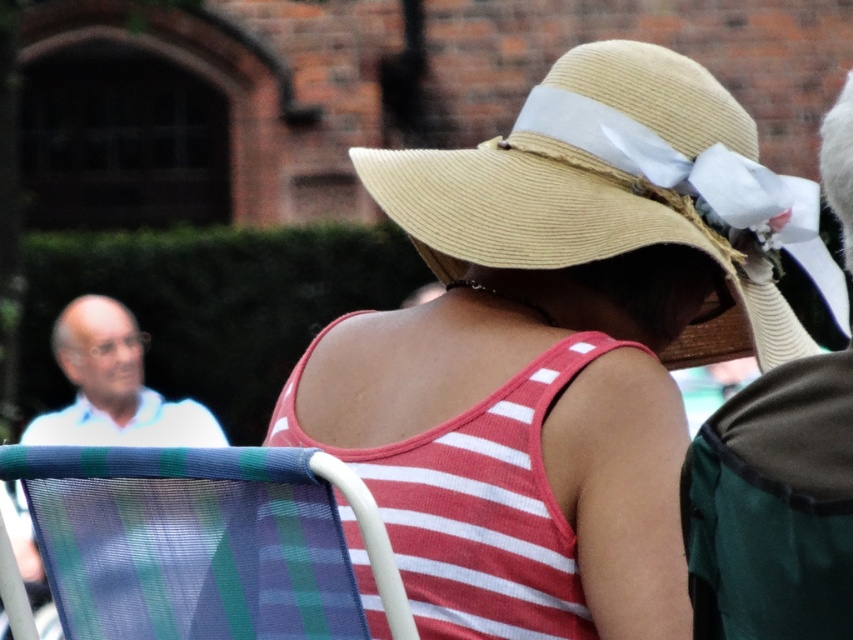
Is point (390, 540) in front of point (198, 547)?

No, (390, 540) is further to viewer.

Who is more forward, (372, 396) or (224, 636)?

Point (224, 636) is more forward.

Where is `straw hat at center`? straw hat at center is located at coordinates (531, 385).

Does natural straw hat at center appear over plaid fabric folding chair at lower left?

Yes.

Can you confirm if natural straw hat at center is positioned below plaid fabric folding chair at lower left?

No, natural straw hat at center is not below plaid fabric folding chair at lower left.

The height and width of the screenshot is (640, 853). What are the coordinates of `natural straw hat at center` in the screenshot? It's located at (616, 186).

Which is more to the left, straw hat at center or natural straw hat at center?

natural straw hat at center is more to the left.

Who is taller, straw hat at center or natural straw hat at center?

With more height is straw hat at center.

Identify the location of straw hat at center. This screenshot has width=853, height=640. [531, 385].